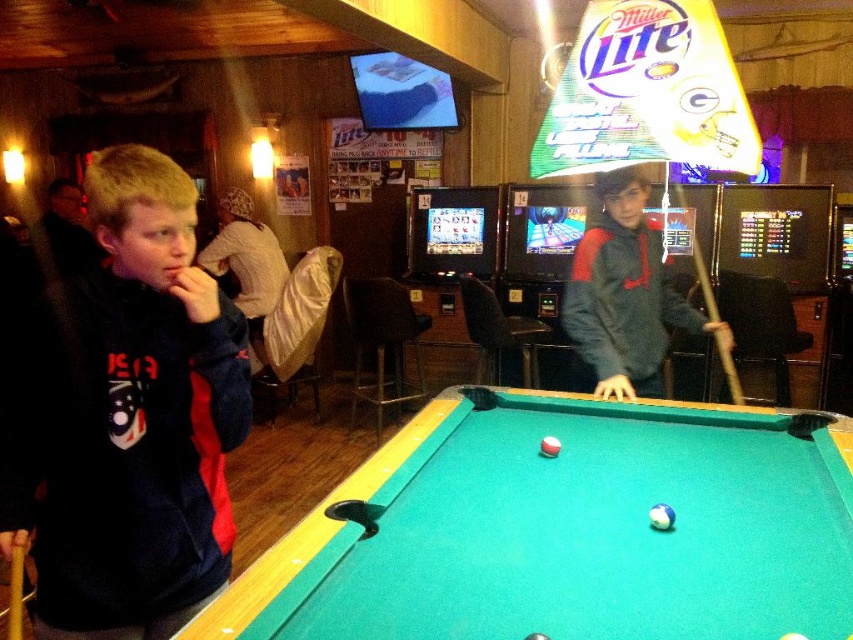
Question: Observing the image, what is the correct spatial positioning of dark blue fleece at left in reference to gray fleece hoodie at center?

Choices:
 (A) below
 (B) above

Answer: (A)

Question: Which point is farther from the camera taking this photo?

Choices:
 (A) (413, 636)
 (B) (662, 300)
 (C) (230, 385)

Answer: (B)

Question: Estimate the real-world distances between objects in this image. Which object is farther from the gray fleece hoodie at center?

Choices:
 (A) brown wooden cue at center
 (B) dark blue fleece at left

Answer: (B)

Question: Which object is farther from the camera taking this photo?

Choices:
 (A) green felt pool table at center
 (B) brown wooden cue at center

Answer: (B)

Question: Is dark blue fleece at left to the left of gray fleece hoodie at center from the viewer's perspective?

Choices:
 (A) yes
 (B) no

Answer: (A)

Question: Can you confirm if dark blue fleece at left is smaller than gray fleece hoodie at center?

Choices:
 (A) no
 (B) yes

Answer: (B)